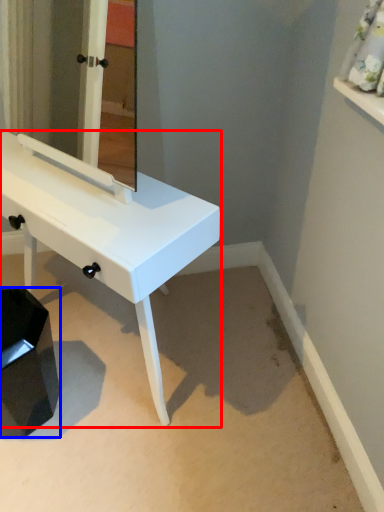
Question: Which point is closer to the camera, table (highlighted by a red box) or step stool (highlighted by a blue box)?

Choices:
 (A) table
 (B) step stool

Answer: (A)